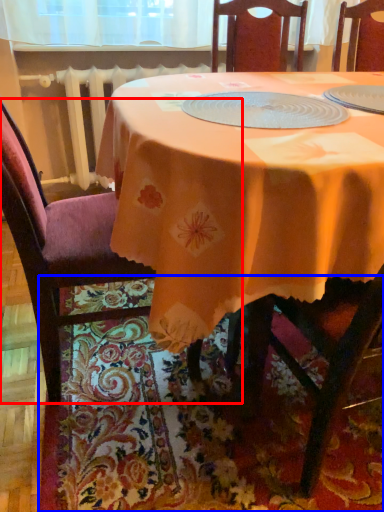
Question: Among these objects, which one is nearest to the camera, chair (highlighted by a red box) or place mat (highlighted by a blue box)?

Choices:
 (A) chair
 (B) place mat

Answer: (A)